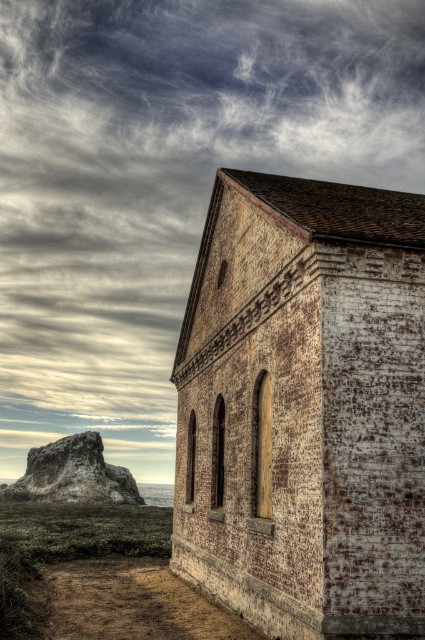
You are standing on the dirt path leading to the rustic brick church at center. You want to reach the church within 10 seconds. What is the minimum speed you need to walk at in meters per second?

The rustic brick church at center is 11.78 meters away. To reach it within 10 seconds, you need to walk at a minimum speed of 1.178 meters per second.

Consider the image. You are standing on the dirt path leading to the building. You want to go to the rustic brick church at center. Which direction should you walk? The point at coordinates (303, 406) marks the location of the church. Use the coordinates to determine the direction.

The point at coordinates (303, 406) indicates the rustic brick church at center is located towards the center of the image, so you should walk straight ahead along the dirt path towards the center to reach it.

You are standing on the dirt path leading to the rustic brick church at center and want to place a small garden statue on the ground near the rustic stone rock at left. Given that the statue is 1 meter tall, will it be visible from the church entrance?

The rustic brick church at center is located above the rustic stone rock at left, so the statue placed near the rustic stone rock at left would be at a lower elevation. Since the church is higher, the statue might be partially visible from the entrance depending on the slope, but the exact visibility isn not specified in the description.